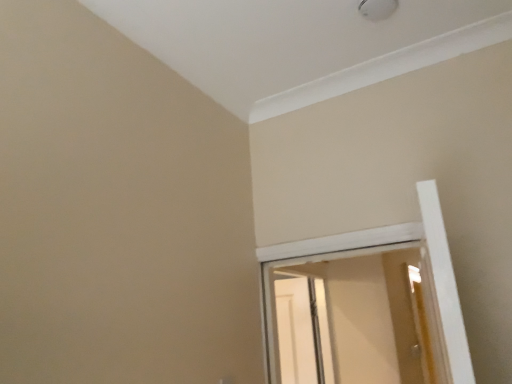
What is the approximate height of clear glass screen door at center?

The height of clear glass screen door at center is 27.52 inches.

What do you see at coordinates (296, 331) in the screenshot?
I see `clear glass screen door at center` at bounding box center [296, 331].

Image resolution: width=512 pixels, height=384 pixels. In order to click on clear glass screen door at center in this screenshot , I will do `click(296, 331)`.

The width and height of the screenshot is (512, 384). Find the location of `clear glass screen door at center`. clear glass screen door at center is located at coordinates (296, 331).